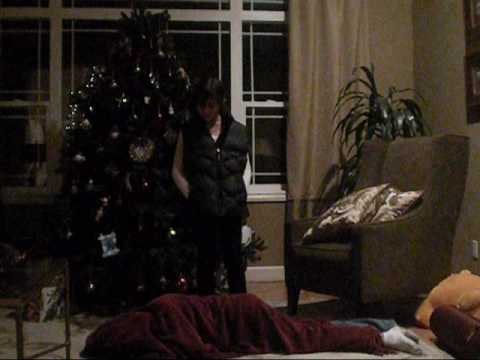
What are the coordinates of `beige chair` in the screenshot? It's located at click(391, 249).